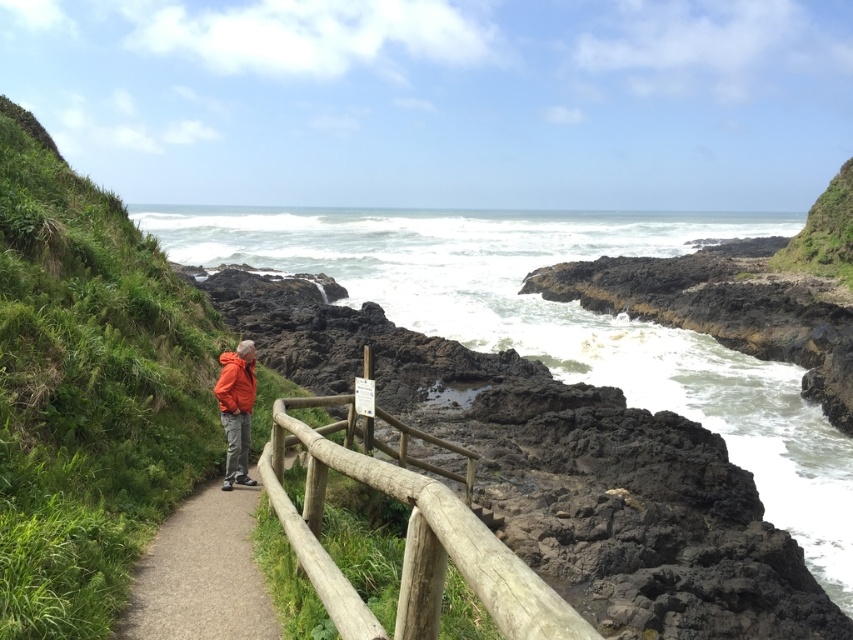
You are a hiker who has just arrived at the coastal path and wants to put on your jacket before continuing. Where should you place the orange fleece jacket at center so that it stays on the gravel path at center while you walk?

The gravel path at center is located below the orange fleece jacket at center, so placing the jacket on the path would require positioning it above the current location of the jacket. However, since the jacket is already at the center, you might need to adjust its position to ensure it stays on the path as you walk.

You are a hiker walking along the gravel path at center. You want to place a small backpack on the natural wood railing at center for a moment. Is the railing within reach from the path?

The natural wood railing at center is above gravel path at center, so yes, the railing is within reach from the gravel path at center.